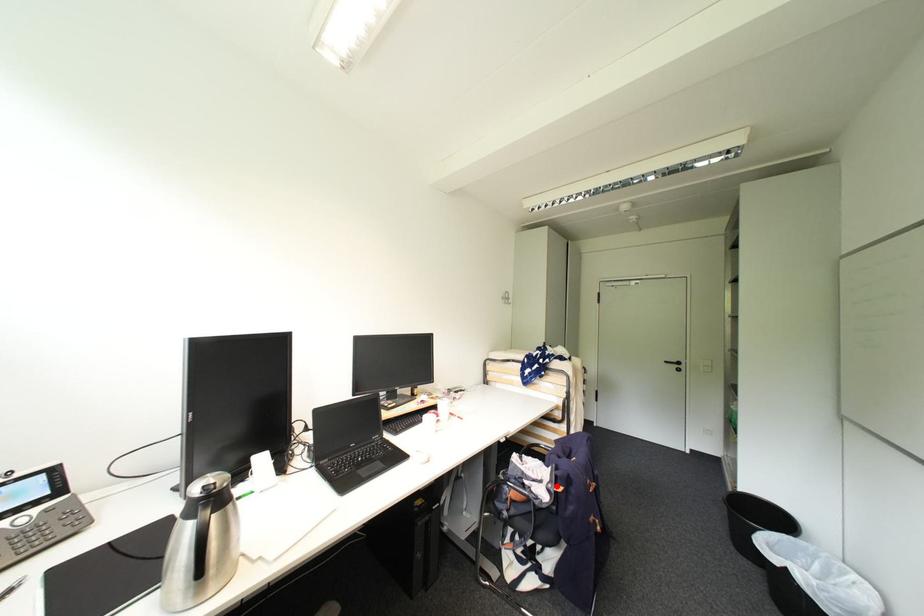
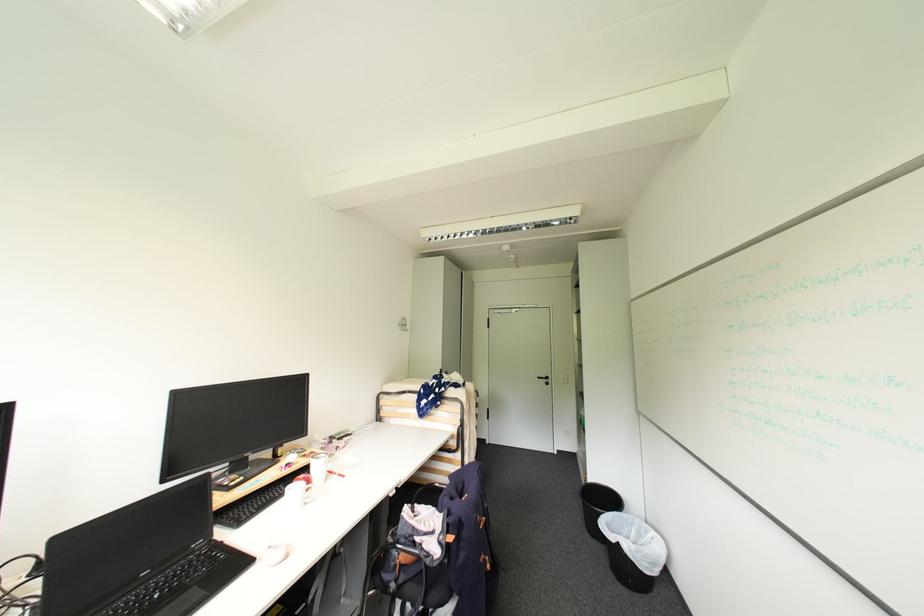
Locate, in the second image, the point that corresponds to the highlighted location in the first image.

(447, 538)